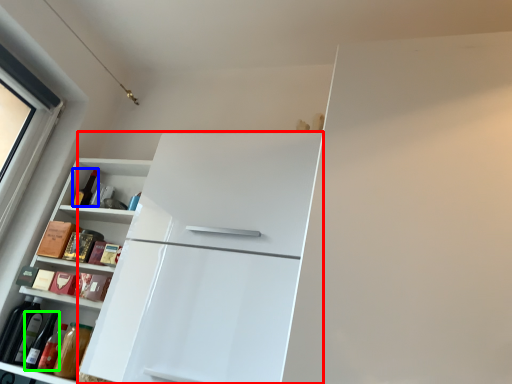
Question: Which object is positioned closest to refrigerator (highlighted by a red box)? Select from bottle (highlighted by a blue box) and wine bottle (highlighted by a green box).

Choices:
 (A) bottle
 (B) wine bottle

Answer: (B)